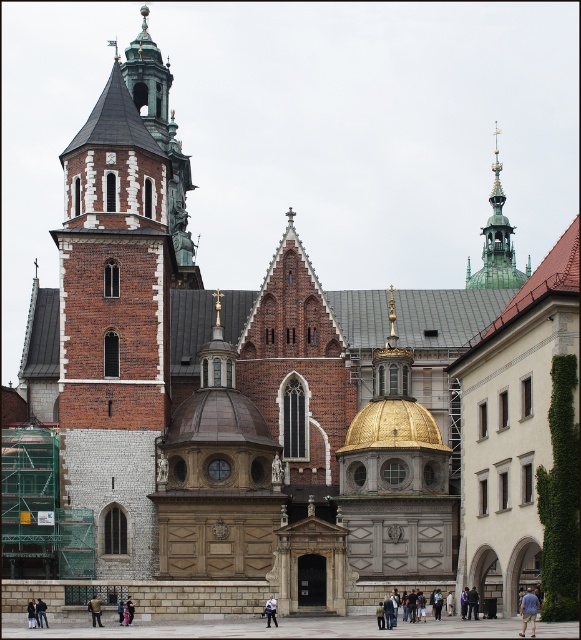
You are standing at the base of the tower with a green copper roof on the left side of the building. You see two points marked on the facade of the grand historical building. According to their positions, which point is closer to you, point (496, 138) or point (98, 611)?

Point (98, 611) is closer to you because point (496, 138) is behind it.

You are a photographer planning to take a photo of the grand historical building. You notice two items at the center of the scene, the light blue jeans at center and the light blue fabric at center. Which one should you focus on if you want to capture the larger object in your shot?

The light blue fabric at center is larger than the light blue jeans at center, so you should focus on the light blue fabric at center to capture the larger object.

You are a photographer standing at the base of the grand historical building. You want to capture a photo that includes both the blue cotton shirt at lower right and the light blue fabric at center. Given that your camera has a maximum focal length of 100mm, which allows you to capture objects up to 100 feet apart in the frame, can you include both items in a single shot without moving your position?

The distance between the blue cotton shirt at lower right and the light blue fabric at center is 57.90 feet, which is within the camera maximum focal length of 100mm. Therefore, you can include both items in a single shot without moving your position.